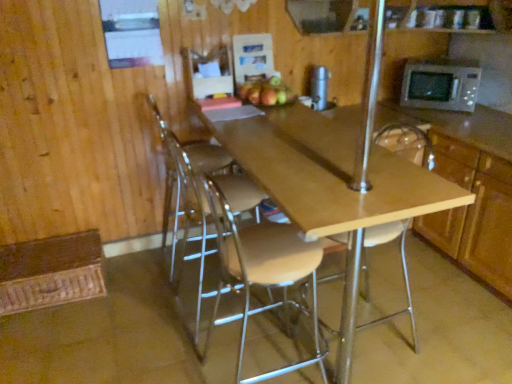
Locate an element on the screen. The width and height of the screenshot is (512, 384). vacant space in front of brown woven mat at lower left is located at coordinates (52, 340).